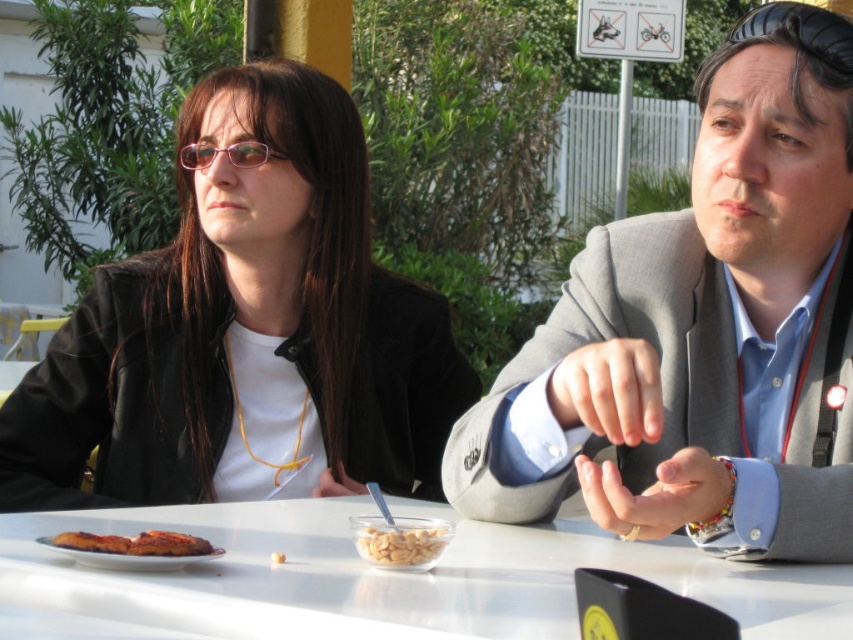
You are a server at a restaurant and need to place a large dessert plate on the table. The dessert plate is the same size as the white glossy table at center. Can you fit it without overlapping the pink plastic glasses at upper center?

The white glossy table at center has a larger size compared to pink plastic glasses at upper center, so the dessert plate can be placed on the table without overlapping the glasses as there is enough space.

You are a photographer taking a picture of the two points on the table between the people. The first point is at coordinate point (283, 97) and the second point is at coordinate point (437, 540). Which point will appear closer to the camera in your photo?

Point (283, 97) will appear closer to the camera in the photo because it is further to the camera than point (437, 540).

You are a server at a restaurant and need to check if the golden crispy pizza at lower left can fit under the pink plastic glasses at upper center. Can it fit vertically?

The golden crispy pizza at lower left is not as tall as the pink plastic glasses at upper center, so it cannot fit vertically under them.